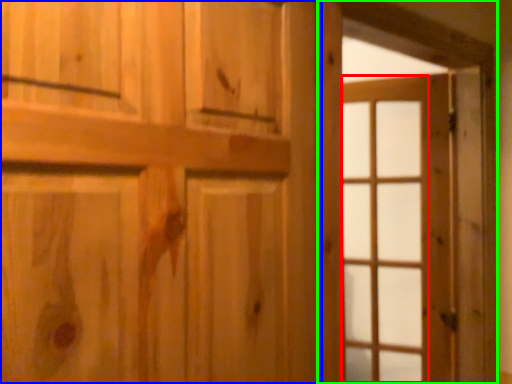
Question: Which object is positioned closest to glass door (highlighted by a red box)? Select from door (highlighted by a blue box) and barn door (highlighted by a green box).

Choices:
 (A) door
 (B) barn door

Answer: (B)